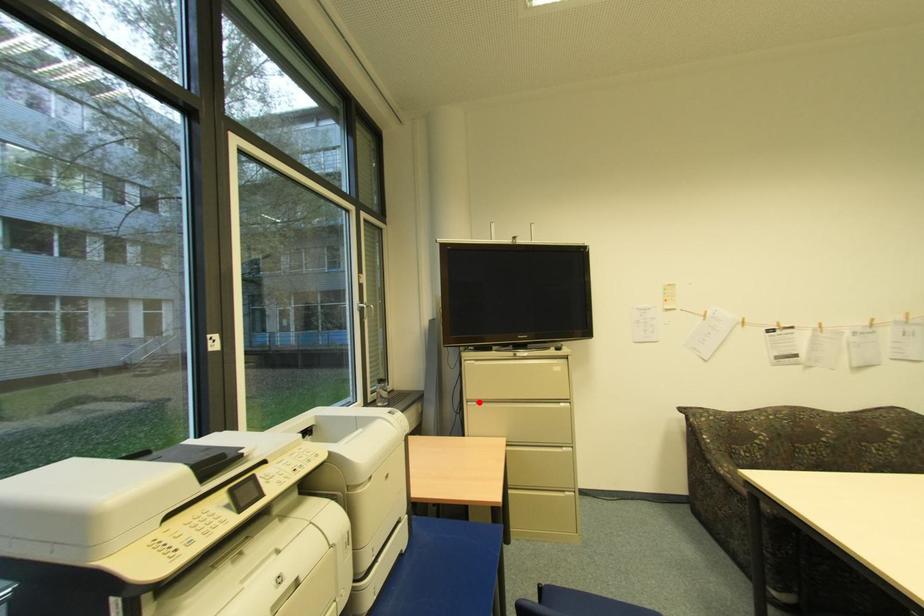
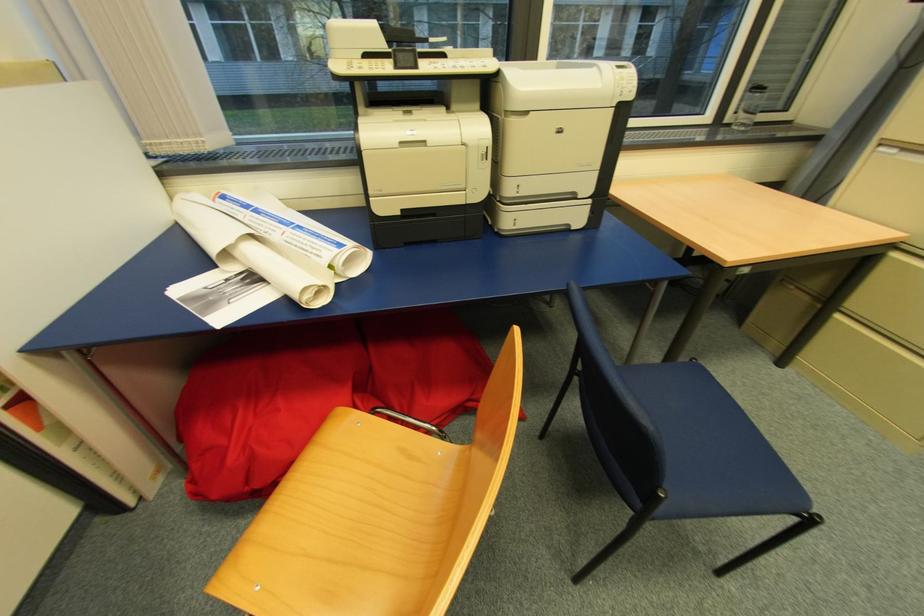
Question: I am providing you with two images of the same scene from different viewpoints. Given a red point in image1, look at the same physical point in image2. Is it:

Choices:
 (A) Closer to the viewpoint
 (B) Farther from the viewpoint

Answer: (B)